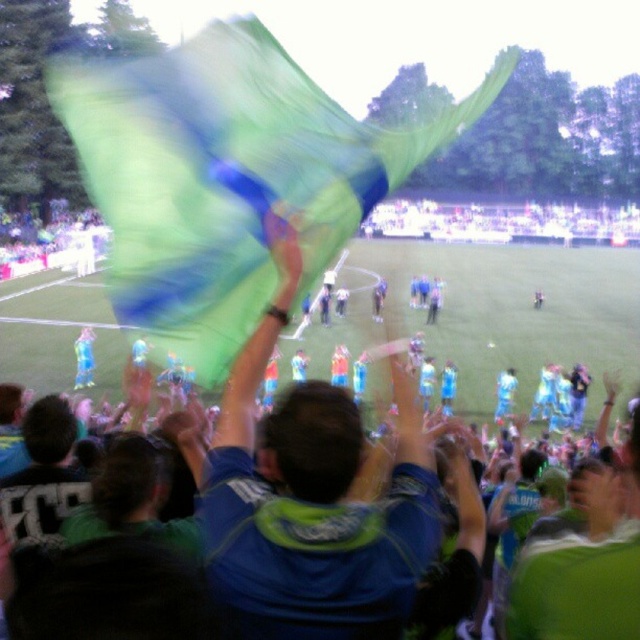
Question: Which point is farther from the camera taking this photo?

Choices:
 (A) (358, 292)
 (B) (348, 426)

Answer: (A)

Question: Is blue fabric at center positioned behind blue fabric flag at upper center?

Choices:
 (A) no
 (B) yes

Answer: (A)

Question: Is blue fabric at center below blue fabric flag at upper center?

Choices:
 (A) no
 (B) yes

Answer: (B)

Question: Can you confirm if blue fabric at center is positioned to the left of blue fabric flag at upper center?

Choices:
 (A) no
 (B) yes

Answer: (B)

Question: Which point is farther to the camera?

Choices:
 (A) (307, 387)
 (B) (614, 291)

Answer: (B)